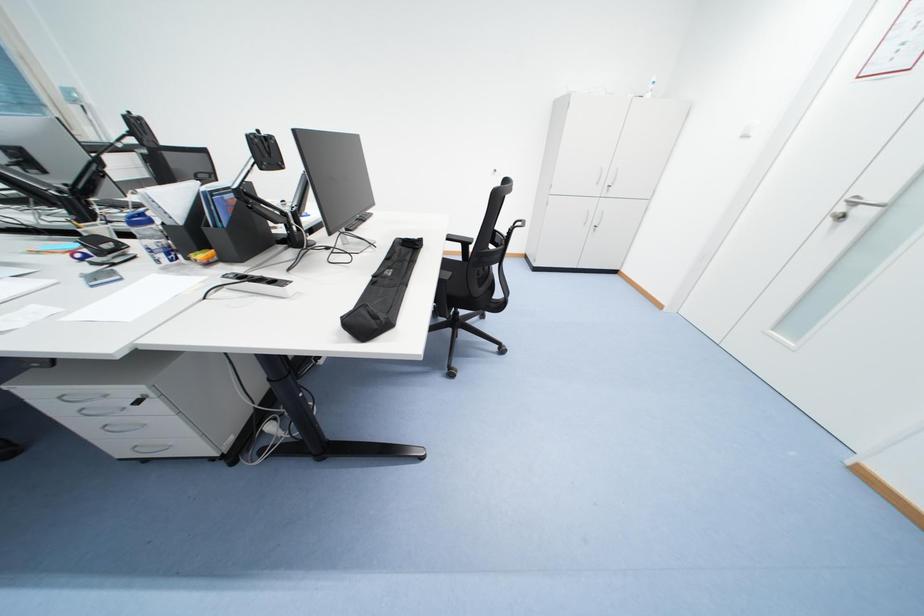
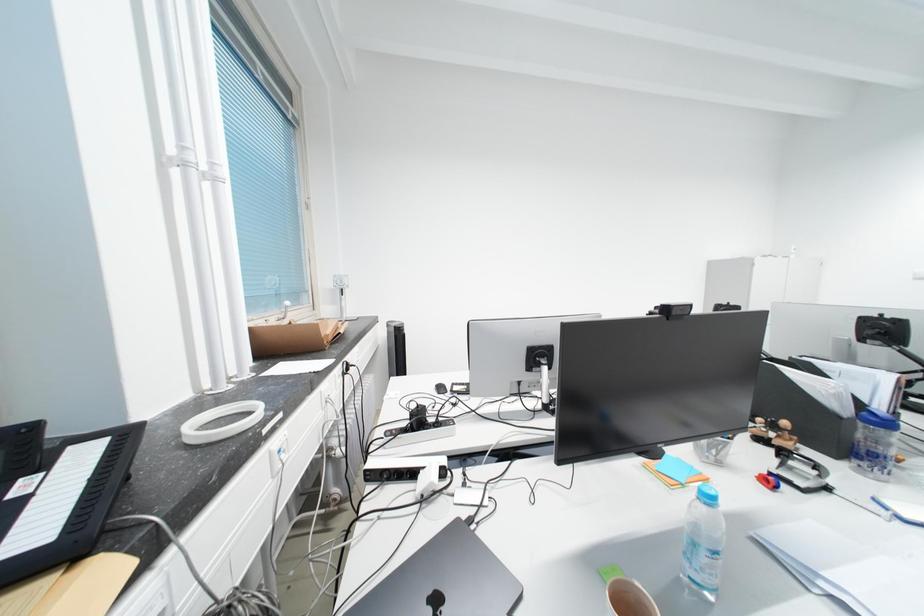
Question: What movement of the cameraman would produce the second image?

Choices:
 (A) Left
 (B) Right
 (C) Forward
 (D) Backward

Answer: (A)